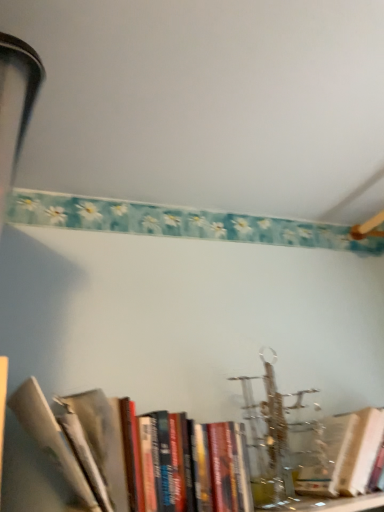
Question: Is hardcover books at lower left, acting as the first book starting from the left, positioned behind hardcover book at center, the first book viewed from the right?

Choices:
 (A) no
 (B) yes

Answer: (A)

Question: Considering the relative sizes of hardcover books at lower left, acting as the first book starting from the left, and hardcover book at center, which appears as the 2th book when viewed from the left, in the image provided, is hardcover books at lower left, acting as the first book starting from the left, bigger than hardcover book at center, which appears as the 2th book when viewed from the left,?

Choices:
 (A) yes
 (B) no

Answer: (A)

Question: Does hardcover books at lower left, which is the second book from right to left, have a greater width compared to hardcover book at center, which appears as the 2th book when viewed from the left?

Choices:
 (A) yes
 (B) no

Answer: (A)

Question: From the image's perspective, does hardcover books at lower left, acting as the first book starting from the left, appear lower than hardcover book at center, which appears as the 2th book when viewed from the left?

Choices:
 (A) yes
 (B) no

Answer: (B)

Question: Is hardcover books at lower left, acting as the first book starting from the left, looking in the opposite direction of hardcover book at center, which appears as the 2th book when viewed from the left?

Choices:
 (A) no
 (B) yes

Answer: (A)

Question: Does hardcover books at lower left, which is the second book from right to left, have a lesser width compared to hardcover book at center, which appears as the 2th book when viewed from the left?

Choices:
 (A) no
 (B) yes

Answer: (A)

Question: From a real-world perspective, does hardcover book at center, the first book viewed from the right, stand above hardcover books at lower left, acting as the first book starting from the left?

Choices:
 (A) yes
 (B) no

Answer: (B)

Question: Is hardcover book at center, the first book viewed from the right, at the right side of hardcover books at lower left, which is the second book from right to left?

Choices:
 (A) yes
 (B) no

Answer: (A)

Question: Is hardcover book at center, which appears as the 2th book when viewed from the left, in front of hardcover books at lower left, which is the second book from right to left?

Choices:
 (A) yes
 (B) no

Answer: (B)

Question: Considering the relative sizes of hardcover book at center, which appears as the 2th book when viewed from the left, and hardcover books at lower left, which is the second book from right to left, in the image provided, is hardcover book at center, which appears as the 2th book when viewed from the left, thinner than hardcover books at lower left, which is the second book from right to left,?

Choices:
 (A) yes
 (B) no

Answer: (A)

Question: From the image's perspective, would you say hardcover book at center, which appears as the 2th book when viewed from the left, is shown under hardcover books at lower left, which is the second book from right to left?

Choices:
 (A) no
 (B) yes

Answer: (B)

Question: From a real-world perspective, is hardcover book at center, which appears as the 2th book when viewed from the left, positioned under hardcover books at lower left, acting as the first book starting from the left, based on gravity?

Choices:
 (A) no
 (B) yes

Answer: (B)

Question: Based on their positions, is hardcover book at center, the first book viewed from the right, located to the left or right of hardcover books at lower left, which is the second book from right to left?

Choices:
 (A) left
 (B) right

Answer: (B)